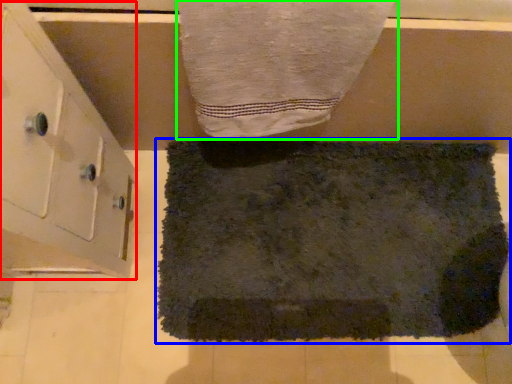
Question: Which object is positioned farthest from cabinetry (highlighted by a red box)? Select from towel (highlighted by a blue box) and towel (highlighted by a green box).

Choices:
 (A) towel
 (B) towel

Answer: (A)